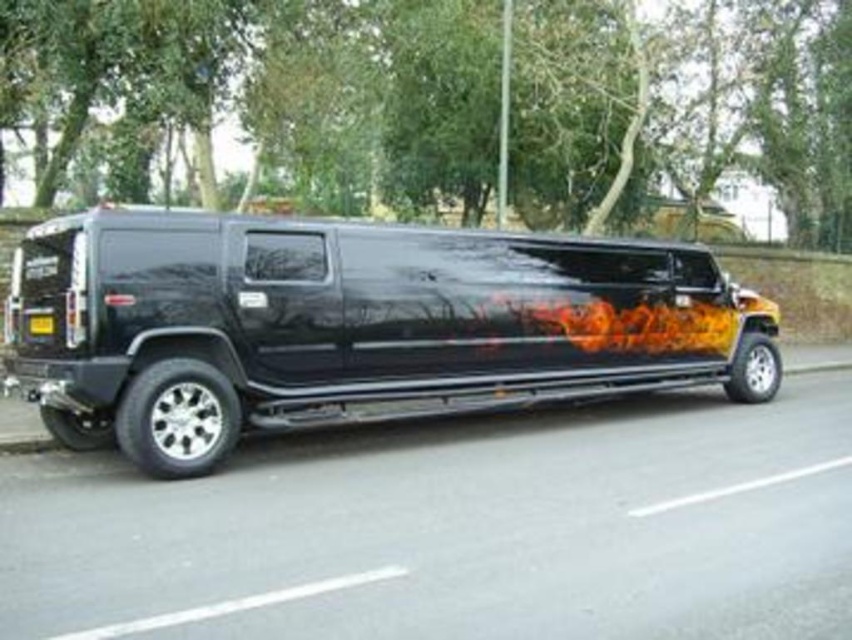
Based on the photo, you are a photographer trying to capture the glossy black limousine at center and the yellow matte license plate at rear in a single shot. Based on their positions, which object should you focus on first to ensure both are in frame?

The glossy black limousine at center is to the right of the yellow matte license plate at rear. Since the limousine is positioned further to the right, you should focus on the yellow matte license plate at rear first to ensure both objects are within the frame.

You are standing at the entrance of the park and see the glossy black limousine at center. If you want to walk directly towards it, which direction should you head?

Since the glossy black limousine at center is located at point coordinates of [352,324], you should walk towards the center of the park to reach it.